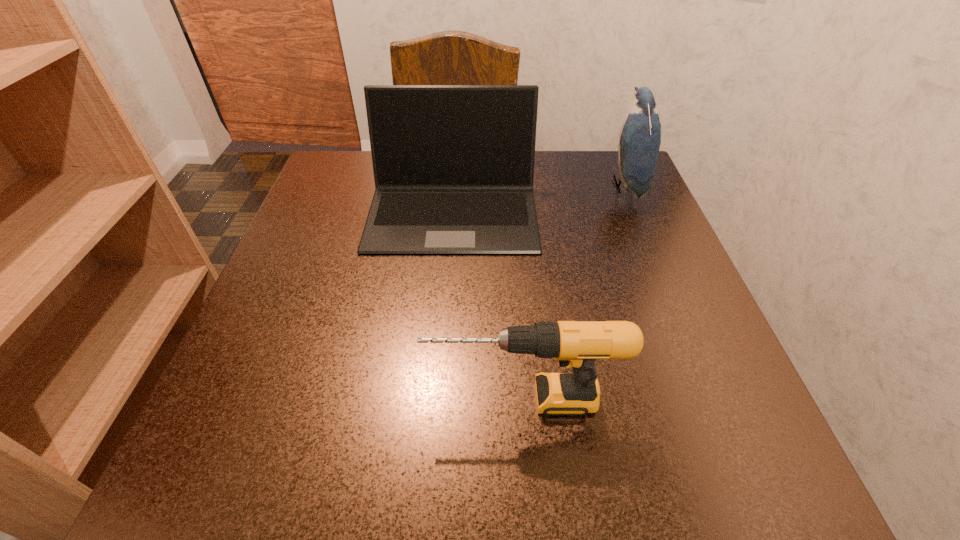
Locate an element on the screen. The height and width of the screenshot is (540, 960). vacant region between the rightmost object and the nearest object is located at coordinates (574, 292).

Locate an element on the screen. The height and width of the screenshot is (540, 960). vacant space that is in between the laptop and the shortest object is located at coordinates (488, 305).

The image size is (960, 540). I want to click on free space between the rightmost object and the laptop, so click(x=539, y=199).

Identify the location of the second closest object to the laptop. click(576, 344).

Locate an element on the screen. This screenshot has height=540, width=960. object that stands as the closest to the bird is located at coordinates pos(453,165).

Locate an element on the screen. The width and height of the screenshot is (960, 540). vacant position in the image that satisfies the following two spatial constraints: 1. at the tip of the bird's beak; 2. on the screen of the laptop is located at coordinates point(636,212).